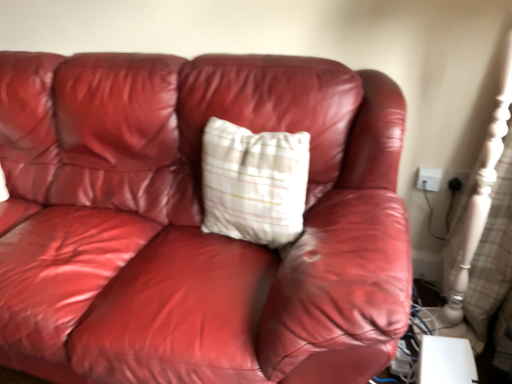
Question: Is the position of white plastic electric outlet at upper right, which is counted as the 2th electric outlet, starting from the right, more distant than that of black plastic outlet at upper right, the 1th electric outlet positioned from the right?

Choices:
 (A) yes
 (B) no

Answer: (A)

Question: From a real-world perspective, is white plastic electric outlet at upper right, arranged as the 1th electric outlet when viewed from the left, on black plastic outlet at upper right, the 2th electric outlet positioned from the left?

Choices:
 (A) no
 (B) yes

Answer: (A)

Question: Is white plastic electric outlet at upper right, which is counted as the 2th electric outlet, starting from the right, oriented towards black plastic outlet at upper right, the 2th electric outlet positioned from the left?

Choices:
 (A) no
 (B) yes

Answer: (A)

Question: Does white plastic electric outlet at upper right, arranged as the 1th electric outlet when viewed from the left, come in front of black plastic outlet at upper right, the 2th electric outlet positioned from the left?

Choices:
 (A) yes
 (B) no

Answer: (B)

Question: Is white plastic electric outlet at upper right, arranged as the 1th electric outlet when viewed from the left, completely or partially outside of black plastic outlet at upper right, the 2th electric outlet positioned from the left?

Choices:
 (A) no
 (B) yes

Answer: (B)

Question: Is white plastic electric outlet at upper right, which is counted as the 2th electric outlet, starting from the right, smaller than black plastic outlet at upper right, the 1th electric outlet positioned from the right?

Choices:
 (A) yes
 (B) no

Answer: (B)

Question: Is plaid fabric pillow at center not inside white plastic electric outlet at upper right, which is counted as the 2th electric outlet, starting from the right?

Choices:
 (A) no
 (B) yes

Answer: (B)

Question: Can you see plaid fabric pillow at center touching white plastic electric outlet at upper right, arranged as the 1th electric outlet when viewed from the left?

Choices:
 (A) yes
 (B) no

Answer: (B)

Question: From the image's perspective, is plaid fabric pillow at center above white plastic electric outlet at upper right, arranged as the 1th electric outlet when viewed from the left?

Choices:
 (A) yes
 (B) no

Answer: (B)

Question: Is plaid fabric pillow at center wider than white plastic electric outlet at upper right, arranged as the 1th electric outlet when viewed from the left?

Choices:
 (A) yes
 (B) no

Answer: (A)

Question: Could you tell me if plaid fabric pillow at center is turned towards white plastic electric outlet at upper right, which is counted as the 2th electric outlet, starting from the right?

Choices:
 (A) no
 (B) yes

Answer: (A)

Question: From the image's perspective, is plaid fabric pillow at center beneath white plastic electric outlet at upper right, arranged as the 1th electric outlet when viewed from the left?

Choices:
 (A) yes
 (B) no

Answer: (A)

Question: Is plaid fabric pillow at center taller than black plastic outlet at upper right, the 2th electric outlet positioned from the left?

Choices:
 (A) yes
 (B) no

Answer: (A)